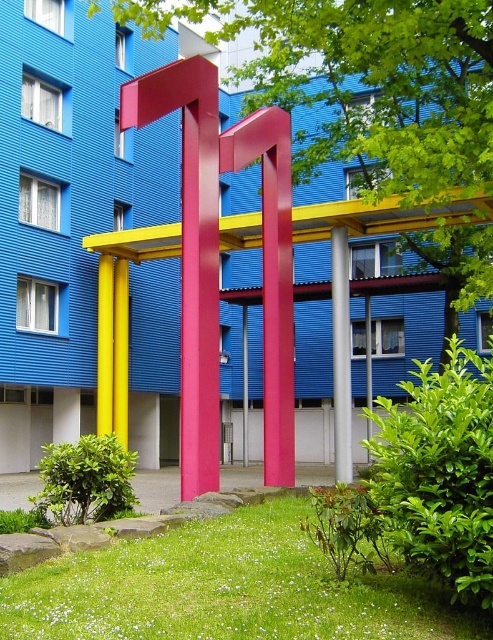
You are an architect analyzing the urban sculpture. The sculpture has two central elements, the white glossy pillar at center and the metallic pink pole at center. Which one is positioned higher relative to the other?

The white glossy pillar at center is positioned higher than the metallic pink pole at center as it is above it.

You are an architect evaluating the urban space. You need to determine if the white glossy pillar at center can be placed inside a storage container that can hold objects up to the size of the metallic pink pole at center. Can it fit?

The white glossy pillar at center has a smaller size compared to metallic pink pole at center, so it can fit inside the storage container designed for the metallic pink pole at center.